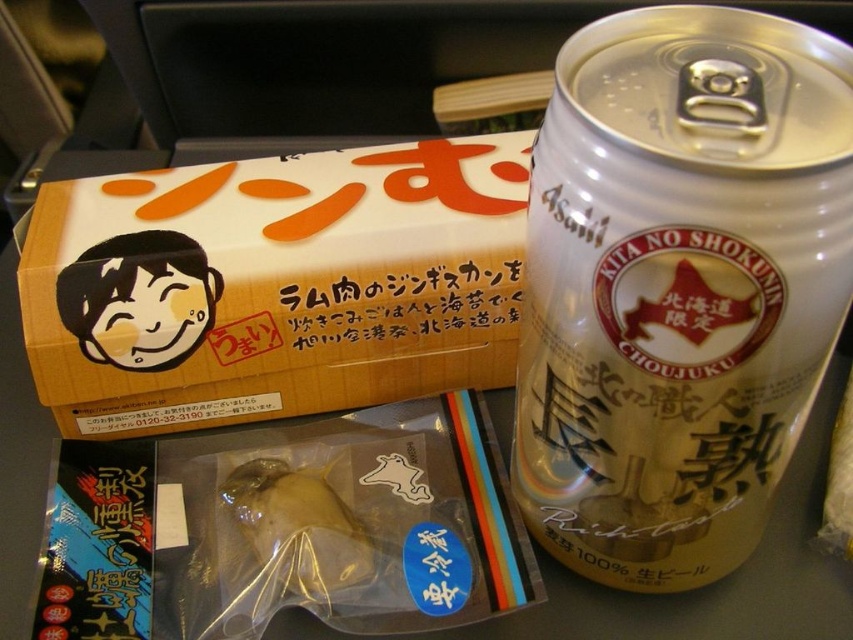
Based on the photo, can you confirm if gold metallic can at right is positioned below translucent plastic fish at center?

Actually, gold metallic can at right is above translucent plastic fish at center.

Measure the distance between gold metallic can at right and translucent plastic fish at center.

They are 10.15 inches apart.

This screenshot has width=853, height=640. What do you see at coordinates (677, 285) in the screenshot?
I see `gold metallic can at right` at bounding box center [677, 285].

The width and height of the screenshot is (853, 640). Find the location of `gold metallic can at right`. gold metallic can at right is located at coordinates (677, 285).

Between point (834, 179) and point (349, 266), which one is positioned behind?

The point (349, 266) is more distant.

The width and height of the screenshot is (853, 640). What are the coordinates of `gold metallic can at right` in the screenshot? It's located at (677, 285).

Locate an element on the screen. gold metallic can at right is located at coordinates (677, 285).

In the scene shown: Can you confirm if wooden-textured box at upper left is positioned to the left of translucent plastic fish at center?

Yes, wooden-textured box at upper left is to the left of translucent plastic fish at center.

This screenshot has width=853, height=640. Identify the location of wooden-textured box at upper left. (274, 284).

Identify the location of wooden-textured box at upper left. click(274, 284).